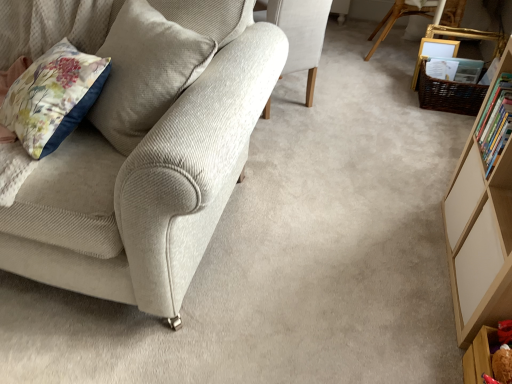
Question: In which direction should I rotate to look at wooden chair at upper center, which is the 1th chair from right to left?

Choices:
 (A) right
 (B) left

Answer: (A)

Question: Is wooden chair at upper center, the 3th chair viewed from the front, oriented away from hardcover book at right?

Choices:
 (A) yes
 (B) no

Answer: (B)

Question: Is wooden chair at upper center, the 1th chair from the back, smaller than hardcover book at right?

Choices:
 (A) no
 (B) yes

Answer: (A)

Question: Is wooden chair at upper center, the 3th chair viewed from the front, facing towards hardcover book at right?

Choices:
 (A) no
 (B) yes

Answer: (A)

Question: Considering the relative positions of wooden chair at upper center, the 1th chair from the back, and hardcover book at right in the image provided, is wooden chair at upper center, the 1th chair from the back, to the left of hardcover book at right from the viewer's perspective?

Choices:
 (A) yes
 (B) no

Answer: (B)

Question: Are wooden chair at upper center, the 1th chair from the back, and hardcover book at right far apart?

Choices:
 (A) no
 (B) yes

Answer: (B)

Question: Considering the relative sizes of wooden chair at upper center, the 1th chair from the back, and hardcover book at right in the image provided, is wooden chair at upper center, the 1th chair from the back, bigger than hardcover book at right?

Choices:
 (A) yes
 (B) no

Answer: (A)

Question: Does wooden shelf at lower right contain hardcover book at right?

Choices:
 (A) yes
 (B) no

Answer: (B)

Question: Is wooden shelf at lower right facing away from hardcover book at right?

Choices:
 (A) yes
 (B) no

Answer: (B)

Question: From a real-world perspective, is wooden shelf at lower right on hardcover book at right?

Choices:
 (A) yes
 (B) no

Answer: (B)

Question: Could you tell me if wooden shelf at lower right is facing hardcover book at right?

Choices:
 (A) no
 (B) yes

Answer: (A)

Question: Is wooden shelf at lower right not near hardcover book at right?

Choices:
 (A) yes
 (B) no

Answer: (B)

Question: From the image's perspective, is wooden shelf at lower right below hardcover book at right?

Choices:
 (A) no
 (B) yes

Answer: (B)

Question: Is wooden picture frame at upper right facing away from light beige fabric chair at center, which appears as the 2th chair when viewed from the back?

Choices:
 (A) no
 (B) yes

Answer: (A)